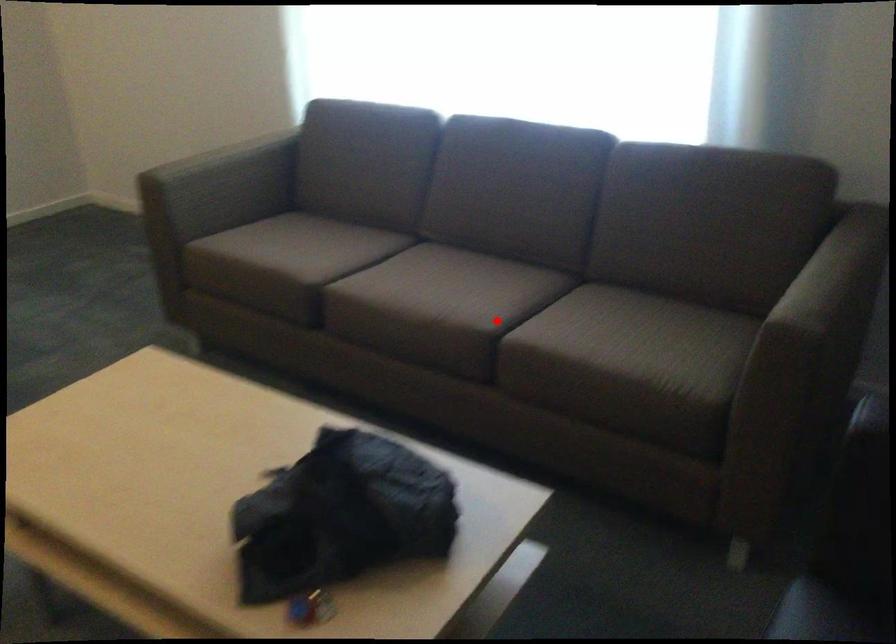
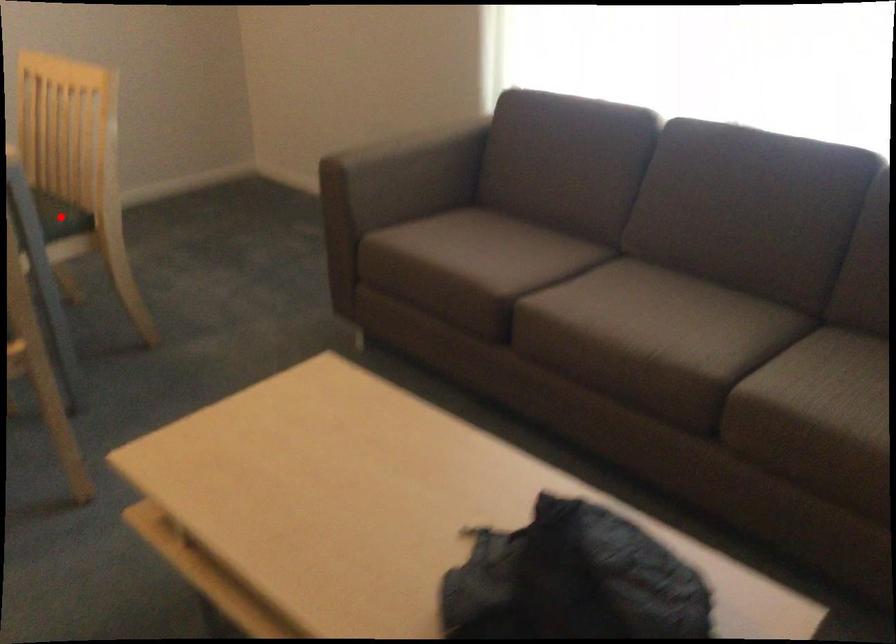
I am providing you with two images of the same scene from different viewpoints. A red point is marked on the first image and another point is marked on the second image. Is the red point in image1 aligned with the point shown in image2?

No